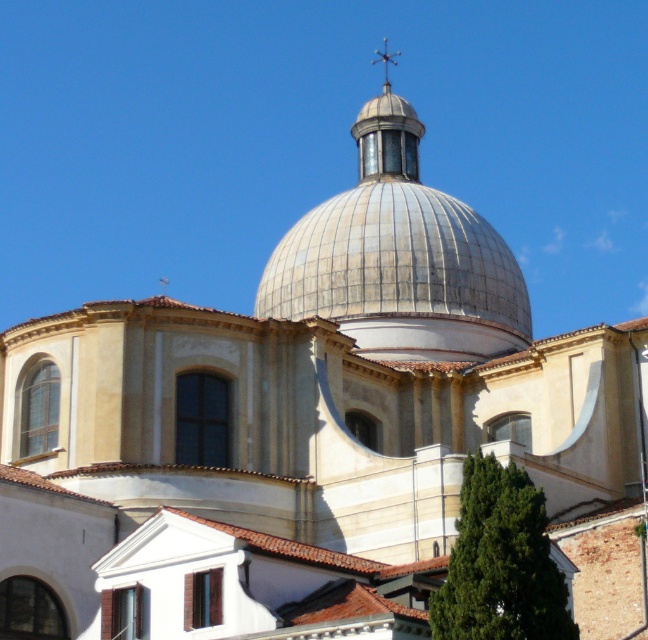
Which is more to the right, metallic silver dome at center or metallic spire at center?

metallic spire at center is more to the right.

You are a GUI agent. You are given a task and a screenshot of the screen. Output one action in this format:
    pyautogui.click(x=<x>, y=<y>)
    Task: Click on the metallic silver dome at center
    
    Given the screenshot: What is the action you would take?
    pyautogui.click(x=399, y=259)